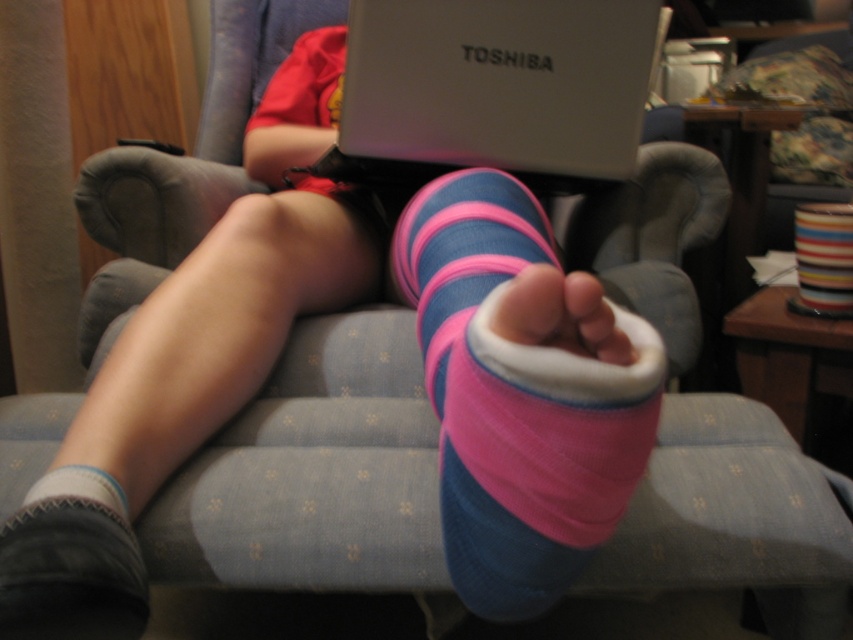
Question: Which point is farther to the camera?

Choices:
 (A) suede-like pink sock at lower left
 (B) pink fabric sock at center
 (C) white plastic laptop at upper center

Answer: (C)

Question: Which of the following is the closest to the observer?

Choices:
 (A) (448, 481)
 (B) (27, 529)

Answer: (B)

Question: In this image, where is pink fabric sock at center located relative to white plastic laptop at upper center?

Choices:
 (A) right
 (B) left

Answer: (A)

Question: Which point is closer to the camera?

Choices:
 (A) (41, 538)
 (B) (364, 72)
 (C) (32, 545)

Answer: (C)

Question: Does pink fabric sock at center have a lesser width compared to gray/soft fabric sock at lower left?

Choices:
 (A) yes
 (B) no

Answer: (A)

Question: Does gray/soft fabric sock at lower left appear under suede-like pink sock at lower left?

Choices:
 (A) no
 (B) yes

Answer: (A)